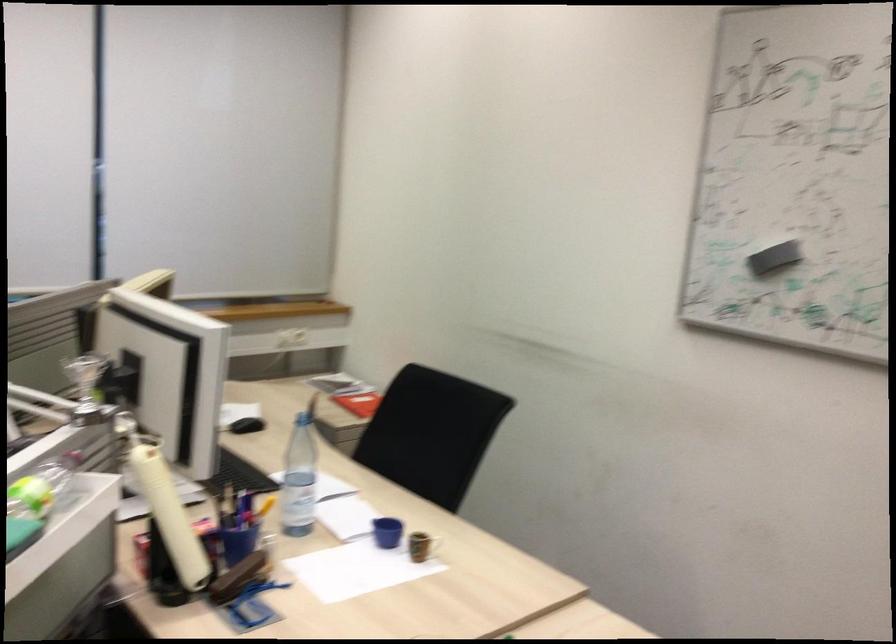
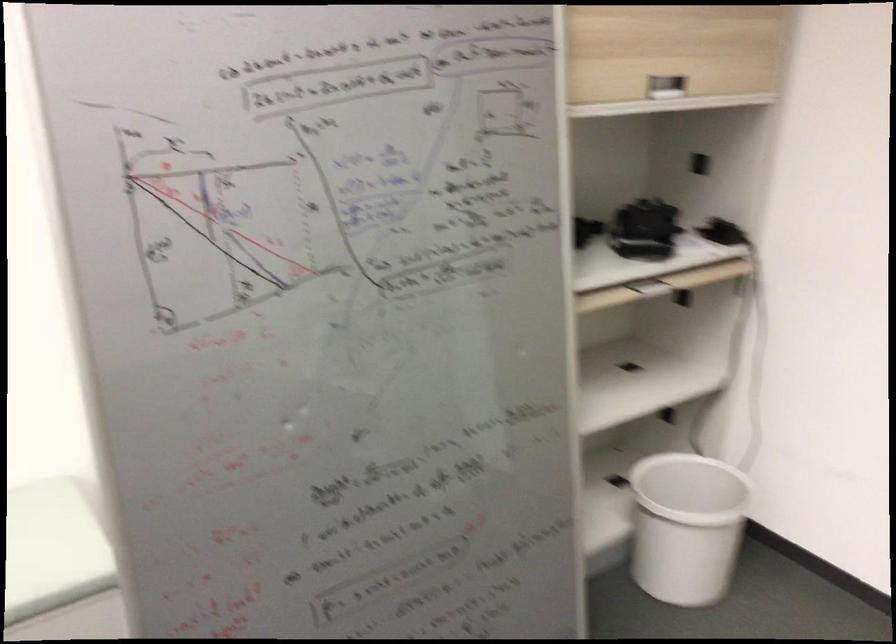
Based on the continuous images, in which direction is the camera rotating?

The camera's rotation is toward right-down.